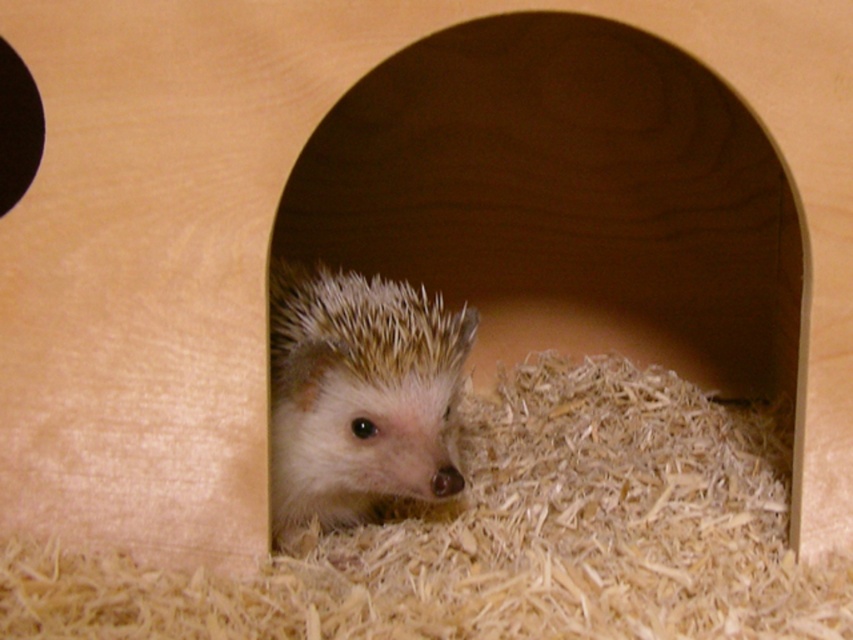
You are a pet owner who wants to ensure your hedgehog has enough space to move around in the enclosure. Based on the image, is the light brown shredded wood at center higher or lower than the white spiny hedgehog at center?

The light brown shredded wood at center is not as tall as the white spiny hedgehog at center, meaning the shredded wood is lower than the hedgehog.

You are a hedgehog in the wooden enclosure and want to find the entrance to get out. Which object is closer to you, the light brown shredded wood at center or the black matte hole at upper left?

The light brown shredded wood at center is in front of the black matte hole at upper left, so the light brown shredded wood at center is closer to you.

Based on the scene, can you determine the position of the white spiny hedgehog at center relative to the black matte hole at upper left?

The white spiny hedgehog at center is to the right of the black matte hole at upper left.